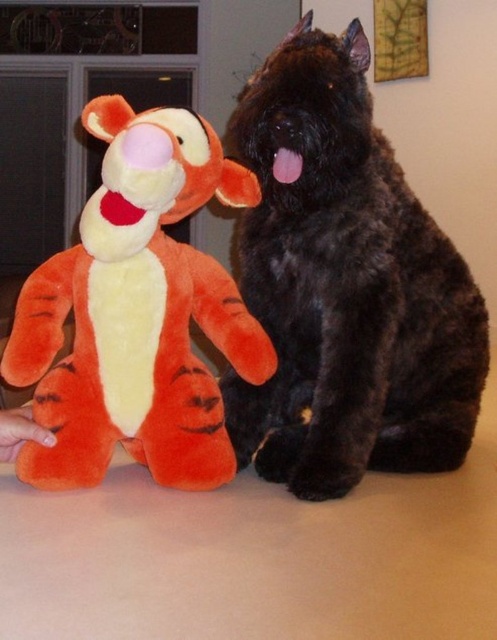
Which is below, black furry dog at center or orange plush toy at left?

orange plush toy at left is below.

Who is more forward, (410,300) or (165,168)?

Positioned in front is point (165,168).

Find the location of a particular element. This screenshot has height=640, width=497. black furry dog at center is located at coordinates (344, 285).

I want to click on black furry dog at center, so click(344, 285).